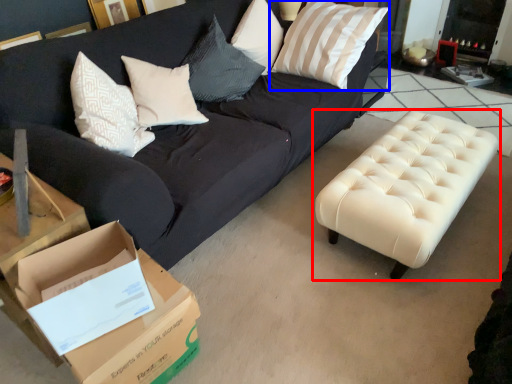
Question: Among these objects, which one is farthest to the camera, table (highlighted by a red box) or pillow (highlighted by a blue box)?

Choices:
 (A) table
 (B) pillow

Answer: (B)